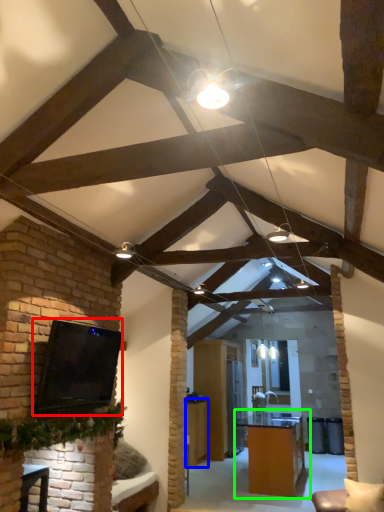
Question: Estimate the real-world distances between objects in this image. Which object is farther from open (highlighted by a red box), table (highlighted by a blue box) or table (highlighted by a green box)?

Choices:
 (A) table
 (B) table

Answer: (A)